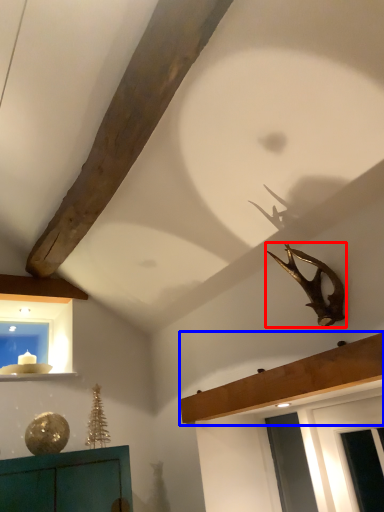
Question: Which object is further to the camera taking this photo, animal (highlighted by a red box) or shelf (highlighted by a blue box)?

Choices:
 (A) animal
 (B) shelf

Answer: (A)